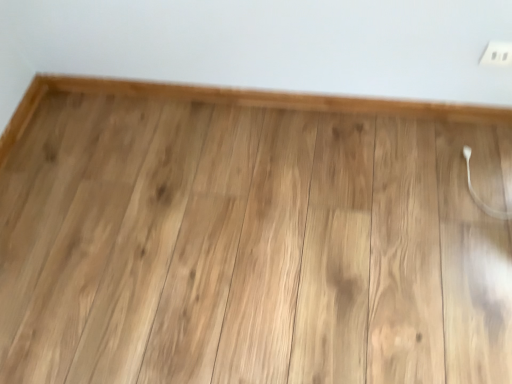
Find the location of a particular element. free point to the left of light wood ledge at upper center is located at coordinates (129, 164).